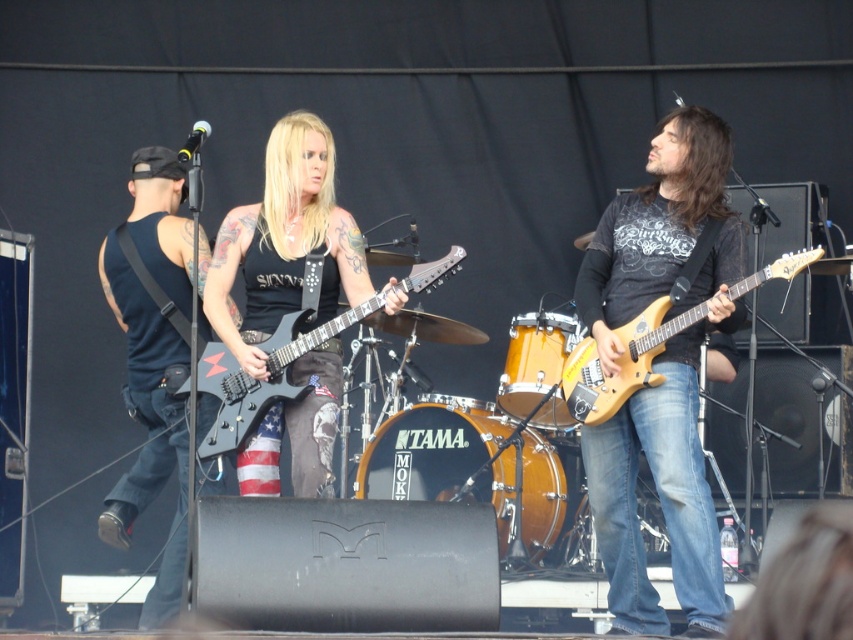
Question: Which object appears farthest from the camera in this image?

Choices:
 (A) glossy black electric guitar at center
 (B) orange drum at center
 (C) matte black guitar at right

Answer: (B)

Question: Is glossy wood electric guitar at center right bigger than wooden drum at center?

Choices:
 (A) yes
 (B) no

Answer: (A)

Question: Among these objects, which one is nearest to the camera?

Choices:
 (A) glossy wood electric guitar at center right
 (B) matte black guitar at center
 (C) matte black guitar at right

Answer: (A)

Question: Is black matte tank top at left to the right of wooden drum at center from the viewer's perspective?

Choices:
 (A) yes
 (B) no

Answer: (B)

Question: Which object is closer to the camera taking this photo?

Choices:
 (A) orange drum at center
 (B) matte black guitar at right
 (C) black matte tank top at left

Answer: (B)

Question: Does matte black guitar at center have a smaller size compared to wooden drum at center?

Choices:
 (A) yes
 (B) no

Answer: (B)